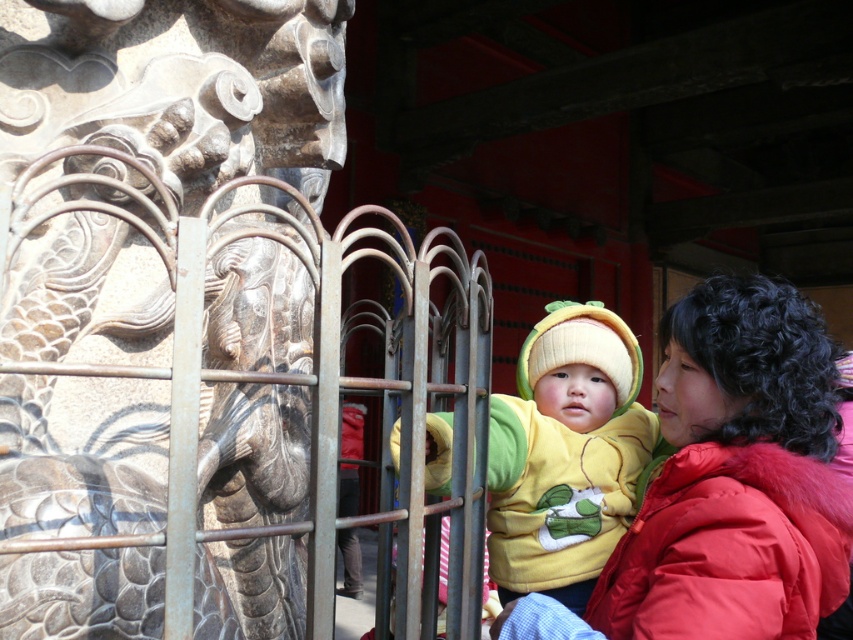
You are standing in front of the stone dragon at center. Where exactly is the dragon located in terms of its 2D coordinates?

The stone dragon at center is located at the 2D coordinates of point (178, 88).

You are a visitor at the temple and want to take a photo of the stone dragon at center without the red puffy coat at right blocking the view. Is the dragon large enough to be seen clearly even if the coat is in front?

The stone dragon at center is bigger than the red puffy coat at right, so even if the coat is in front, the dragon will still be visible clearly as it is larger in size.

Based on the photo, you are a photographer standing at the back of the scene. You want to take a photo of the red puffy coat at right and the yellow fleece at center. If your camera can only focus on objects within 10 inches of each other, will both subjects be in focus?

The distance between the red puffy coat at right and the yellow fleece at center is 12.89 inches, which is beyond the 10 inches focus range. Therefore, both subjects cannot be in focus simultaneously.